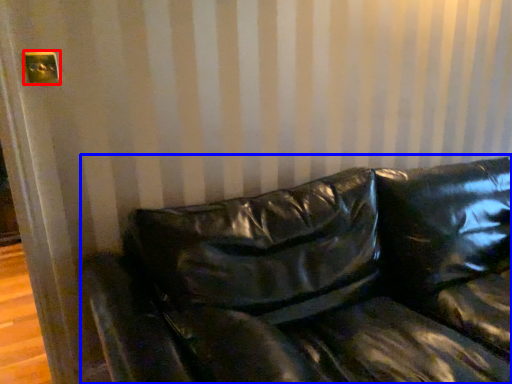
Question: Which object is closer to the camera taking this photo, electric outlet (highlighted by a red box) or studio couch (highlighted by a blue box)?

Choices:
 (A) electric outlet
 (B) studio couch

Answer: (B)